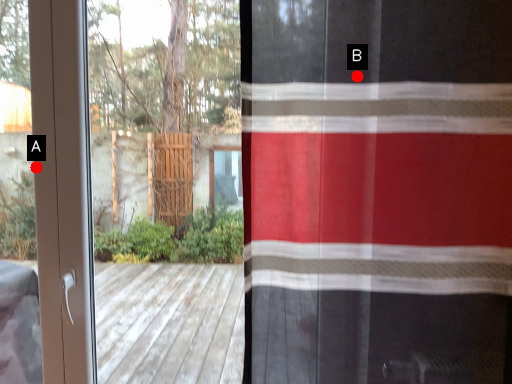
Question: Two points are circled on the image, labeled by A and B beside each circle. Among these points, which one is nearest to the camera?

Choices:
 (A) A is closer
 (B) B is closer

Answer: (B)